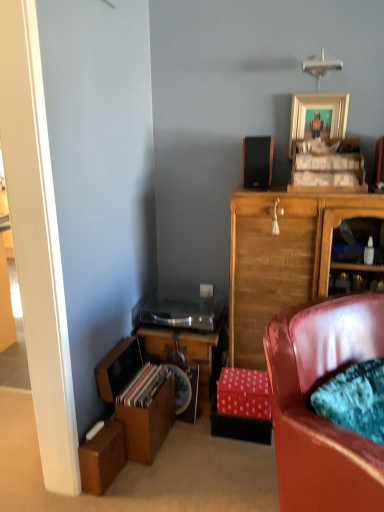
Question: From the image's perspective, is gold metallic picture frame at upper center beneath pink polka dot cardboard box at lower center, arranged as the 2th cardboard box when viewed from the left?

Choices:
 (A) yes
 (B) no

Answer: (B)

Question: Does gold metallic picture frame at upper center have a smaller size compared to pink polka dot cardboard box at lower center, which is the second cardboard box in bottom-to-top order?

Choices:
 (A) no
 (B) yes

Answer: (B)

Question: Considering the relative positions of gold metallic picture frame at upper center and pink polka dot cardboard box at lower center, the first cardboard box viewed from the right, in the image provided, is gold metallic picture frame at upper center behind pink polka dot cardboard box at lower center, the first cardboard box viewed from the right,?

Choices:
 (A) yes
 (B) no

Answer: (A)

Question: Is gold metallic picture frame at upper center facing away from pink polka dot cardboard box at lower center, the 1th cardboard box in the top-to-bottom sequence?

Choices:
 (A) yes
 (B) no

Answer: (B)

Question: From a real-world perspective, is gold metallic picture frame at upper center physically below pink polka dot cardboard box at lower center, the first cardboard box viewed from the right?

Choices:
 (A) no
 (B) yes

Answer: (A)

Question: Is velvet teal cushion at lower right wider or thinner than wooden desk at lower left?

Choices:
 (A) wide
 (B) thin

Answer: (B)

Question: From the image's perspective, is velvet teal cushion at lower right positioned above or below wooden desk at lower left?

Choices:
 (A) below
 (B) above

Answer: (B)

Question: Relative to wooden desk at lower left, is velvet teal cushion at lower right in front or behind?

Choices:
 (A) front
 (B) behind

Answer: (A)

Question: From a real-world perspective, is velvet teal cushion at lower right above or below wooden desk at lower left?

Choices:
 (A) below
 (B) above

Answer: (B)

Question: Is gold metallic picture frame at upper center situated inside pink polka dot cardboard box at lower center, arranged as the 2th cardboard box when viewed from the left, or outside?

Choices:
 (A) inside
 (B) outside

Answer: (B)

Question: In terms of size, does gold metallic picture frame at upper center appear bigger or smaller than pink polka dot cardboard box at lower center, arranged as the 2th cardboard box when viewed from the left?

Choices:
 (A) big
 (B) small

Answer: (B)

Question: Is gold metallic picture frame at upper center in front of or behind pink polka dot cardboard box at lower center, which is the second cardboard box in bottom-to-top order, in the image?

Choices:
 (A) behind
 (B) front

Answer: (A)

Question: Does point (347, 112) appear closer or farther from the camera than point (241, 415)?

Choices:
 (A) farther
 (B) closer

Answer: (A)

Question: Considering the relative positions of gold metallic picture frame at upper center and velvet teal cushion at lower right in the image provided, is gold metallic picture frame at upper center to the left or to the right of velvet teal cushion at lower right?

Choices:
 (A) left
 (B) right

Answer: (B)

Question: From a real-world perspective, is gold metallic picture frame at upper center positioned above or below velvet teal cushion at lower right?

Choices:
 (A) above
 (B) below

Answer: (A)